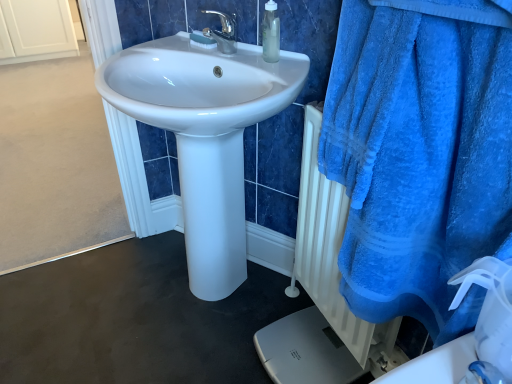
Question: In terms of height, does blue plush towel at right look taller or shorter compared to white plastic brush at upper center?

Choices:
 (A) short
 (B) tall

Answer: (B)

Question: In the image, is blue plush towel at right positioned in front of or behind white plastic brush at upper center?

Choices:
 (A) front
 (B) behind

Answer: (A)

Question: Which of these objects is positioned farthest from the white plastic brush at upper center?

Choices:
 (A) white textured radiator at lower right
 (B) blue plush towel at right
 (C) white glossy sink at center
 (D) silver metallic scale at lower right
 (E) translucent plastic bottle at upper center

Answer: (D)

Question: Estimate the real-world distances between objects in this image. Which object is farther from the white glossy sink at center?

Choices:
 (A) blue plush towel at right
 (B) translucent plastic bottle at upper center
 (C) white plastic brush at upper center
 (D) white textured radiator at lower right
 (E) silver metallic scale at lower right

Answer: (E)